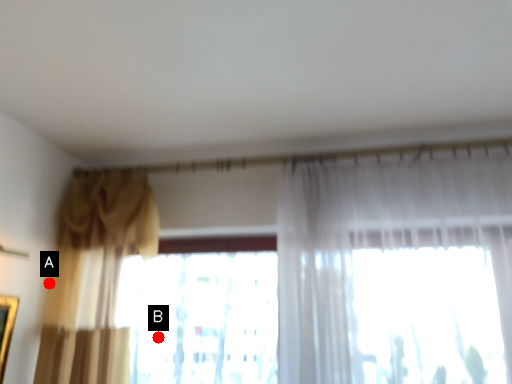
Question: Two points are circled on the image, labeled by A and B beside each circle. Among these points, which one is farthest from the camera?

Choices:
 (A) A is further
 (B) B is further

Answer: (B)